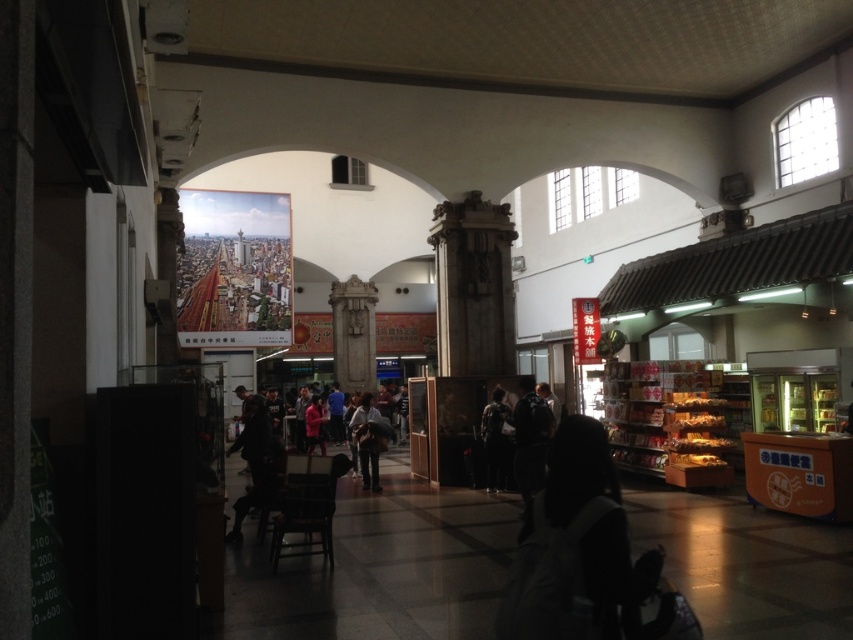
Question: Which object appears farthest from the camera in this image?

Choices:
 (A) dark gray fabric jacket at center
 (B) dark gray pants at center
 (C) matte red jacket at center

Answer: (C)

Question: Can you confirm if dark gray fabric jacket at center is smaller than matte red jacket at center?

Choices:
 (A) yes
 (B) no

Answer: (A)

Question: Which of the following is the farthest from the observer?

Choices:
 (A) (560, 570)
 (B) (517, 460)

Answer: (B)

Question: Does dark gray fabric jacket at center have a greater width compared to dark gray pants at center?

Choices:
 (A) no
 (B) yes

Answer: (A)

Question: Can you confirm if dark fabric backpack at lower center is wider than dark gray fabric jacket at center?

Choices:
 (A) yes
 (B) no

Answer: (A)

Question: Based on their relative distances, which object is farther from the matte red jacket at center?

Choices:
 (A) dark blue jacket at center
 (B) dark fabric backpack at lower center
 (C) dark gray fabric jacket at center

Answer: (B)